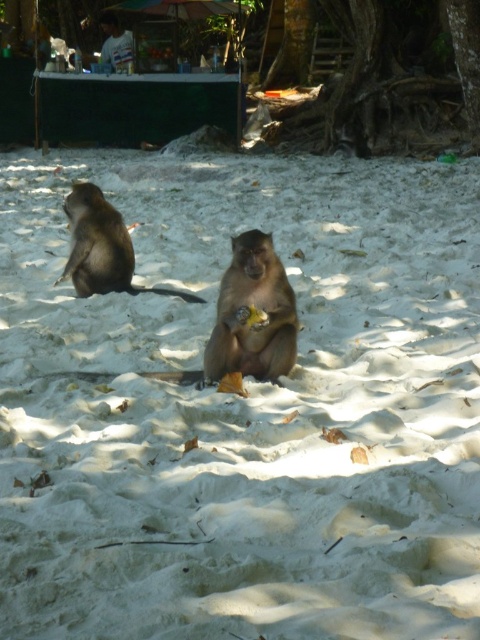
Which of these two, brown furry monkey at center or brown furry monkey at left, stands taller?

brown furry monkey at left is taller.

Is brown furry monkey at center to the right of brown furry monkey at left from the viewer's perspective?

Indeed, brown furry monkey at center is positioned on the right side of brown furry monkey at left.

This screenshot has height=640, width=480. What do you see at coordinates (249, 308) in the screenshot?
I see `brown furry monkey at center` at bounding box center [249, 308].

This screenshot has height=640, width=480. I want to click on brown furry monkey at center, so pos(249,308).

Which is below, brown rough tree roots at lower center or brown furry monkey at left?

Positioned lower is brown furry monkey at left.

Is brown rough tree roots at lower center to the left of brown furry monkey at left from the viewer's perspective?

Incorrect, brown rough tree roots at lower center is not on the left side of brown furry monkey at left.

Who is more distant from viewer, (x=337, y=36) or (x=108, y=256)?

The point (x=337, y=36) is behind.

Identify the location of brown rough tree roots at lower center. (375, 74).

Does brown rough tree roots at lower center come in front of brown furry monkey at center?

No, brown rough tree roots at lower center is behind brown furry monkey at center.

Does brown rough tree roots at lower center appear over brown furry monkey at center?

Correct, brown rough tree roots at lower center is located above brown furry monkey at center.

Where is `brown rough tree roots at lower center`? The width and height of the screenshot is (480, 640). brown rough tree roots at lower center is located at coordinates (375, 74).